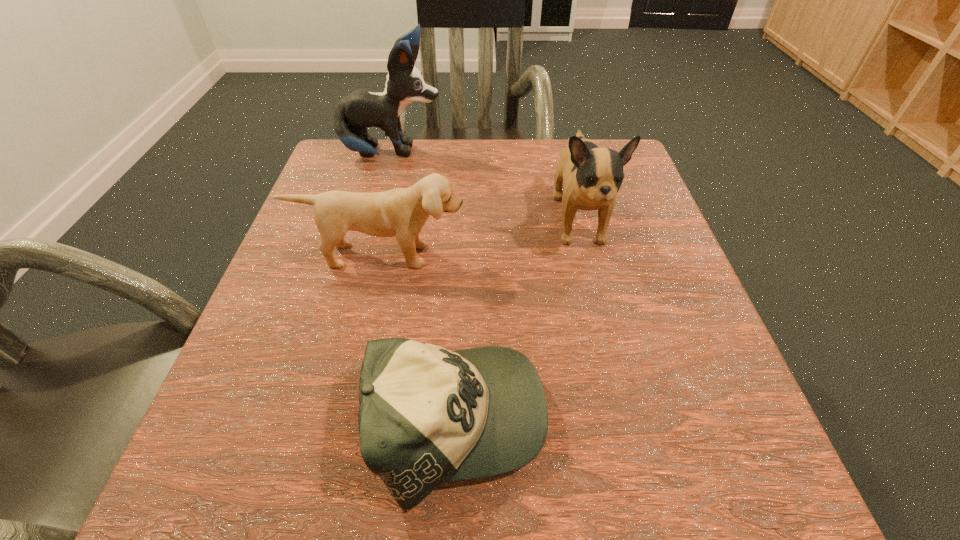
What are the coordinates of `the tallest puppy` in the screenshot? It's located at (363, 108).

I want to click on the farthest object, so click(x=363, y=108).

Identify the location of the rightmost object. This screenshot has width=960, height=540. (592, 175).

Identify the location of the rightmost puppy. (592, 175).

Locate an element on the screen. the third tallest object is located at coordinates (402, 212).

Identify the location of baseball cap. This screenshot has height=540, width=960. (427, 415).

Where is `the shortest object`? the shortest object is located at coordinates (427, 415).

At what (x,y) coordinates should I click in order to perform the action: click on free location located 0.280m on the front-facing side of the farthest puppy. Please return your answer as a coordinate pair (x, y). The width and height of the screenshot is (960, 540). Looking at the image, I should click on (560, 154).

This screenshot has width=960, height=540. I want to click on vacant space located 0.120m at the face of the rightmost object, so click(602, 316).

Identify the location of free space located on the left side of the second shortest object. (365, 327).